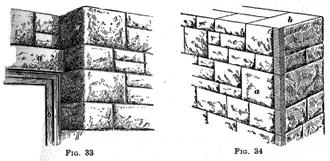
Image resolution: width=330 pixels, height=161 pixels. Find the location of `empty space of the doorway`. empty space of the doorway is located at coordinates (21, 106).